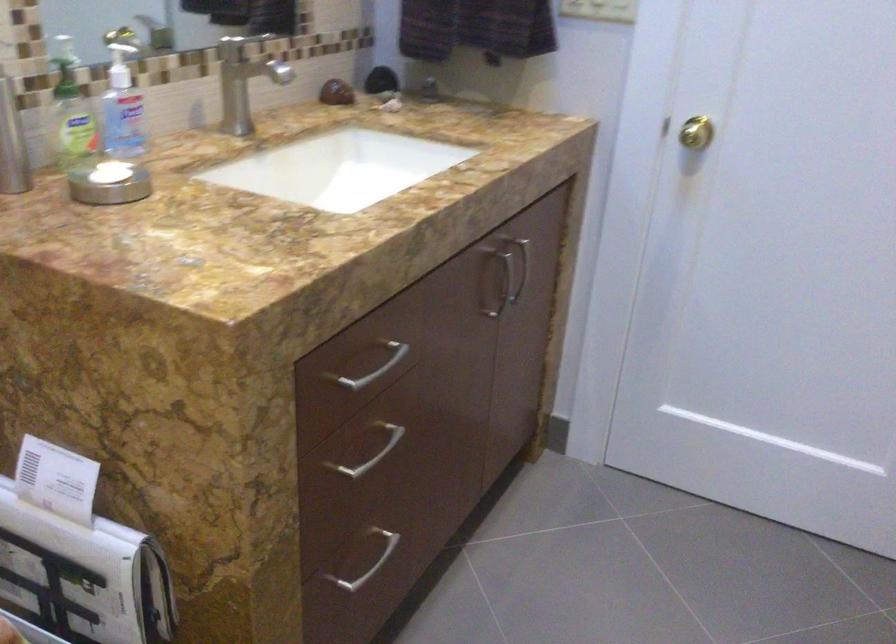
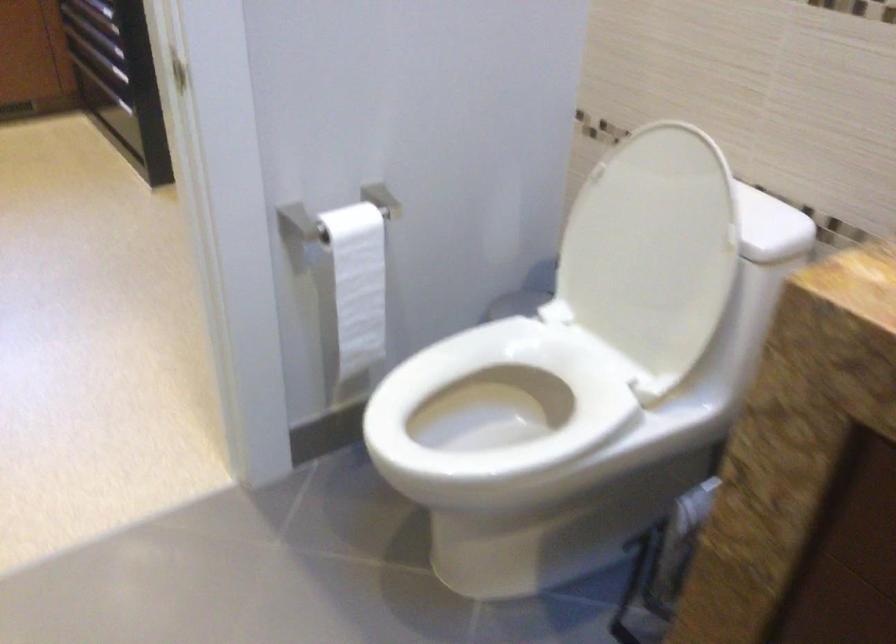
The images are taken continuously from a first-person perspective. In which direction is your viewpoint rotating?

The rotation direction of the camera is left-down.